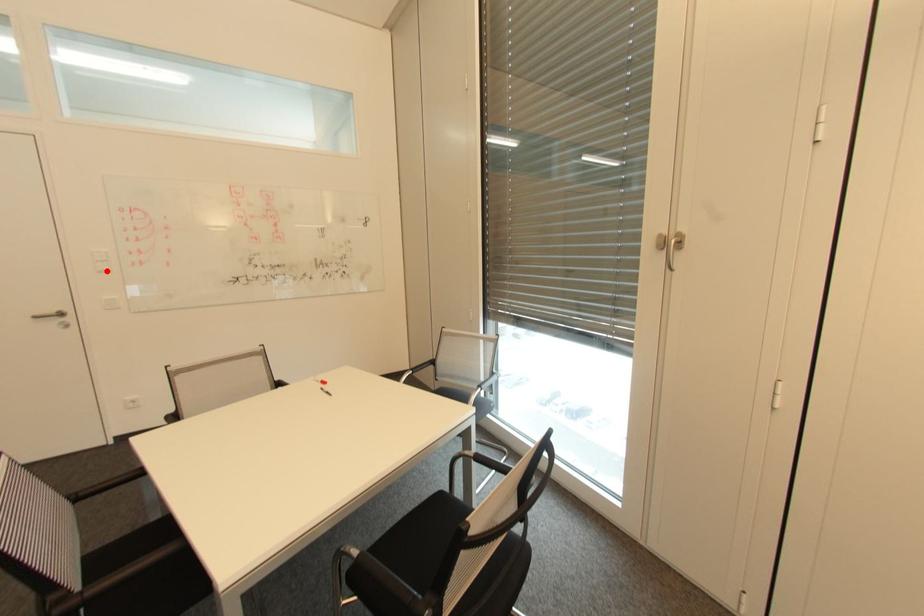
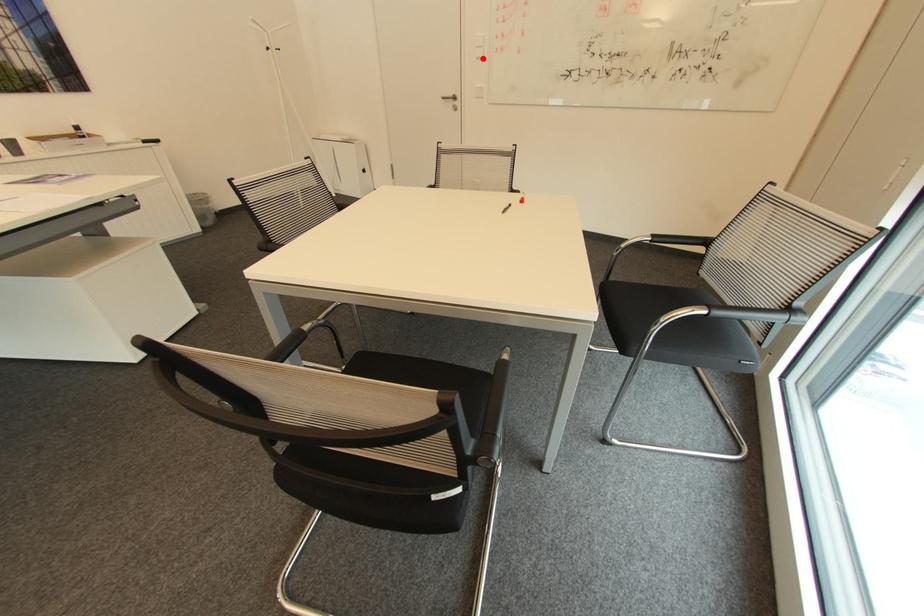
I am providing you with two images of the same scene from different viewpoints. A red point is marked on the first image and another point is marked on the second image. Are the points marked in image1 and image2 representing the same 3D position?

Yes